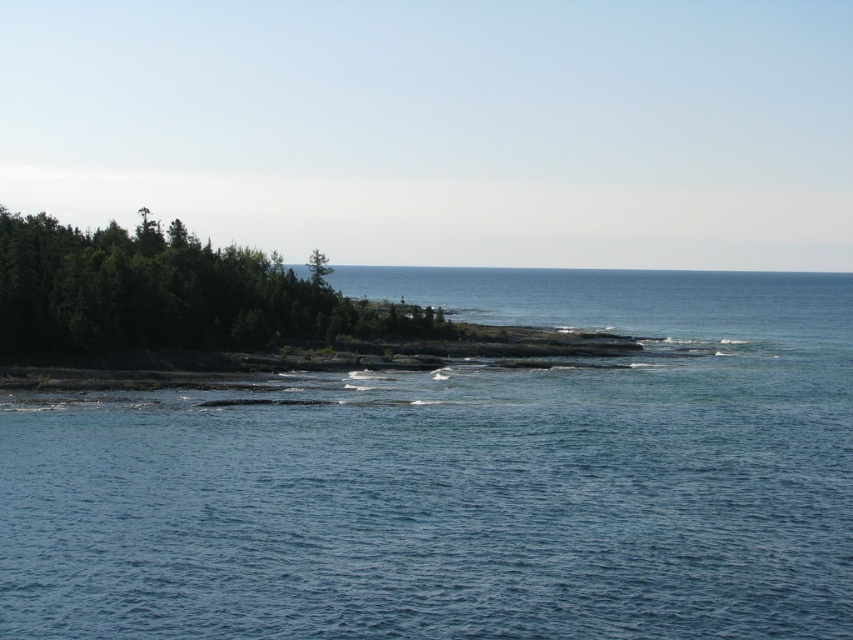
Question: Among these objects, which one is nearest to the camera?

Choices:
 (A) blue water at center
 (B) green leafy trees at left

Answer: (A)

Question: Which point is closer to the camera?

Choices:
 (A) (132, 576)
 (B) (282, 294)

Answer: (A)

Question: Which object is closer to the camera taking this photo?

Choices:
 (A) blue water at center
 (B) green leafy trees at left

Answer: (A)

Question: Can you confirm if blue water at center is smaller than green leafy trees at left?

Choices:
 (A) yes
 (B) no

Answer: (B)

Question: Can you confirm if blue water at center is bigger than green leafy trees at left?

Choices:
 (A) no
 (B) yes

Answer: (B)

Question: Is blue water at center to the right of green leafy trees at left from the viewer's perspective?

Choices:
 (A) no
 (B) yes

Answer: (B)